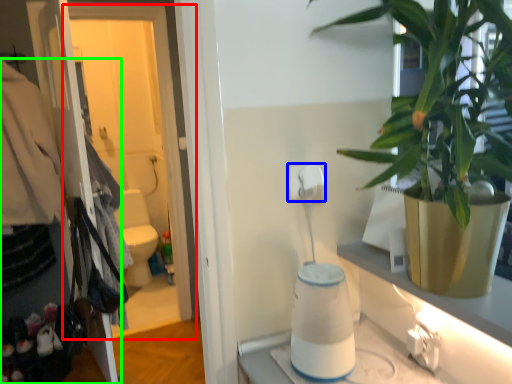
Question: Estimate the real-world distances between objects in this image. Which object is farther from screen door (highlighted by a red box), toilet paper (highlighted by a blue box) or closet (highlighted by a green box)?

Choices:
 (A) toilet paper
 (B) closet

Answer: (A)